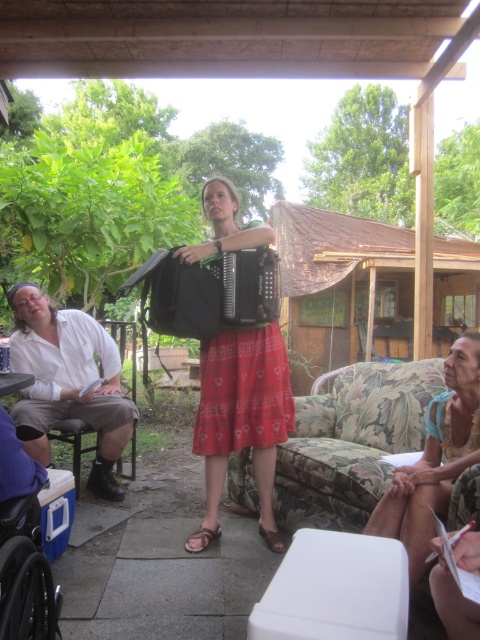
You are a guest at this outdoor gathering and want to sit down. You see the floral fabric couch at lower center and the white cotton shirt at left. Which object is located to the right of the other?

The floral fabric couch at lower center is positioned on the right side of white cotton shirt at left.

You are a caterer setting up a small table between the matte black accordion at center and the white cotton shirt at left. The table must be 3 feet wide. Will there be enough space between them to place the table?

The distance between the matte black accordion at center and the white cotton shirt at left is 35.59 inches. Since 3 feet is equal to 36 inches, the space is slightly insufficient. The table will not fit comfortably between them.

You are standing at point (x=99, y=342) and want to walk to point (x=363, y=461). Based on the scene description, which direction should you move to reach your destination?

To reach point (x=363, y=461) from point (x=99, y=342), you should move forward since point (x=363, y=461) is in front of point (x=99, y=342).